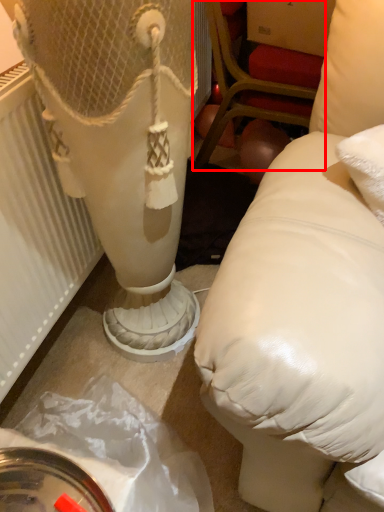
Question: Considering the relative positions of furniture (annotated by the red box) and radiator in the image provided, where is furniture (annotated by the red box) located with respect to the staircase?

Choices:
 (A) left
 (B) right

Answer: (B)